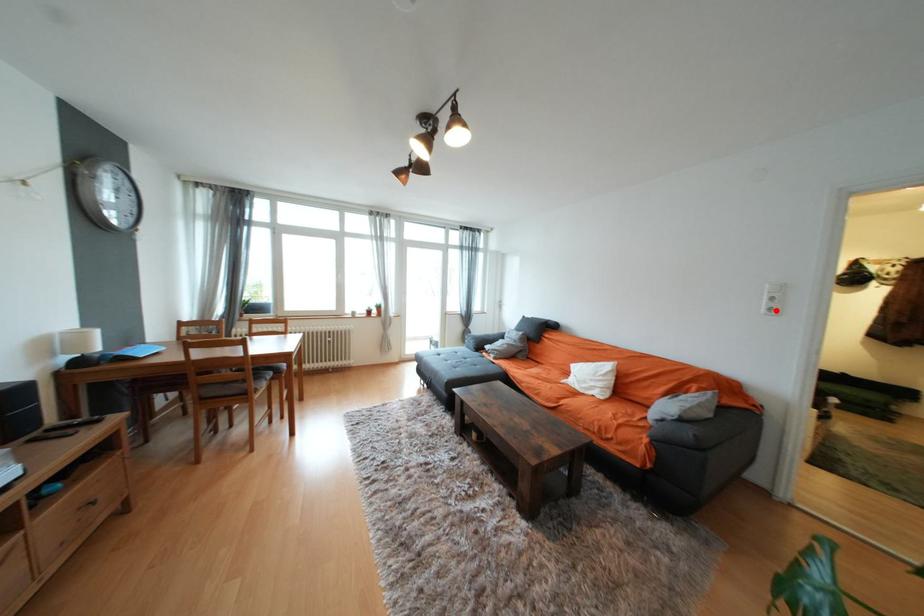
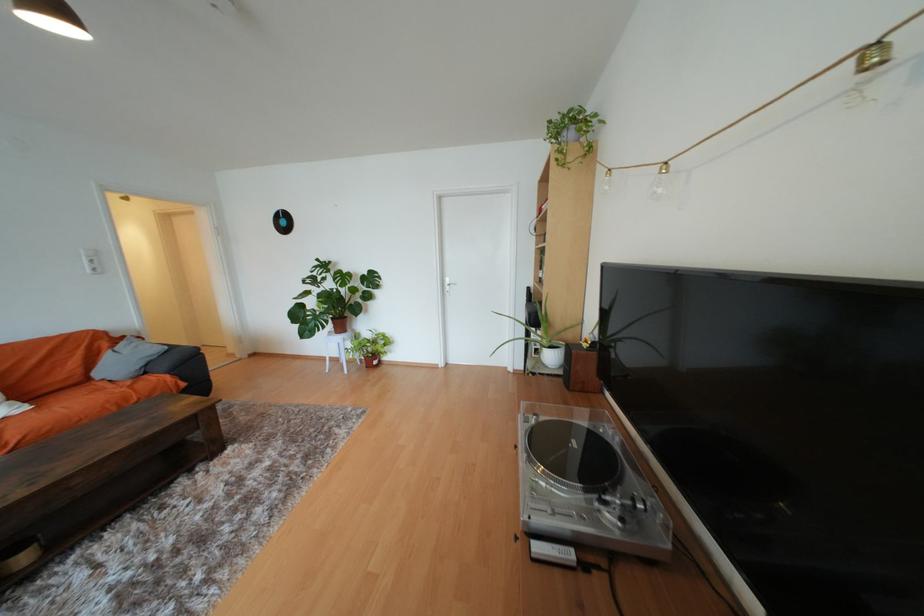
Locate, in the second image, the point that corresponds to the highlighted location in the first image.

(101, 270)